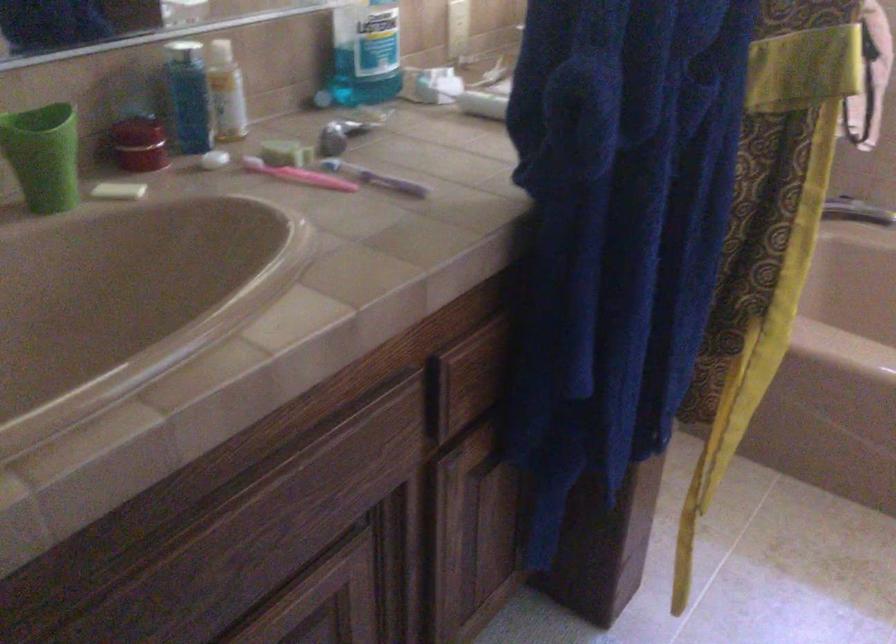
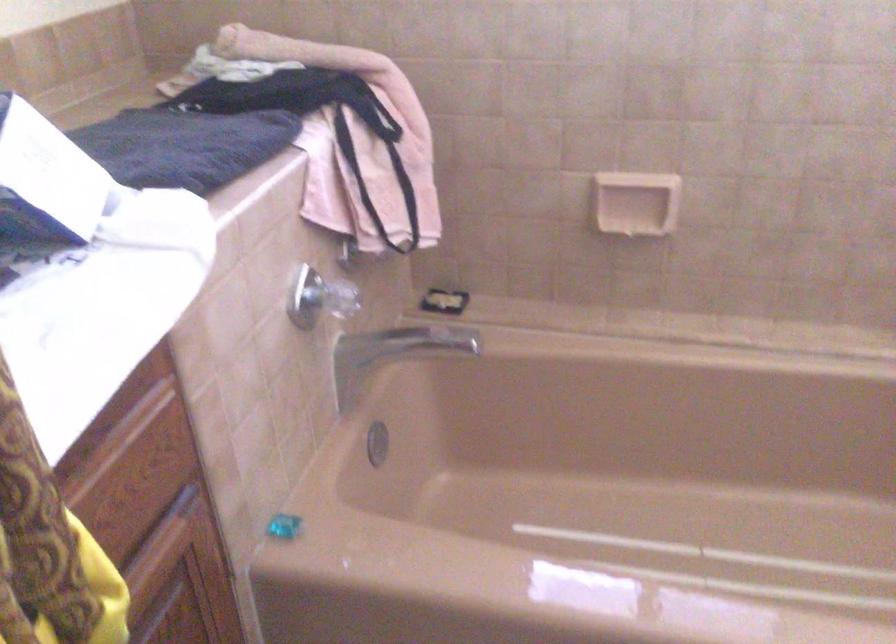
Which direction would the cameraman need to move to produce the second image?

The movement direction of the cameraman is right, forward.